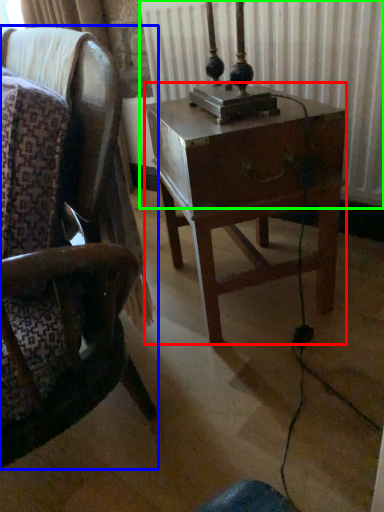
Question: Based on their relative distances, which object is nearer to nightstand (highlighted by a red box)? Choose from chair (highlighted by a blue box) and radiator (highlighted by a green box).

Choices:
 (A) chair
 (B) radiator

Answer: (A)